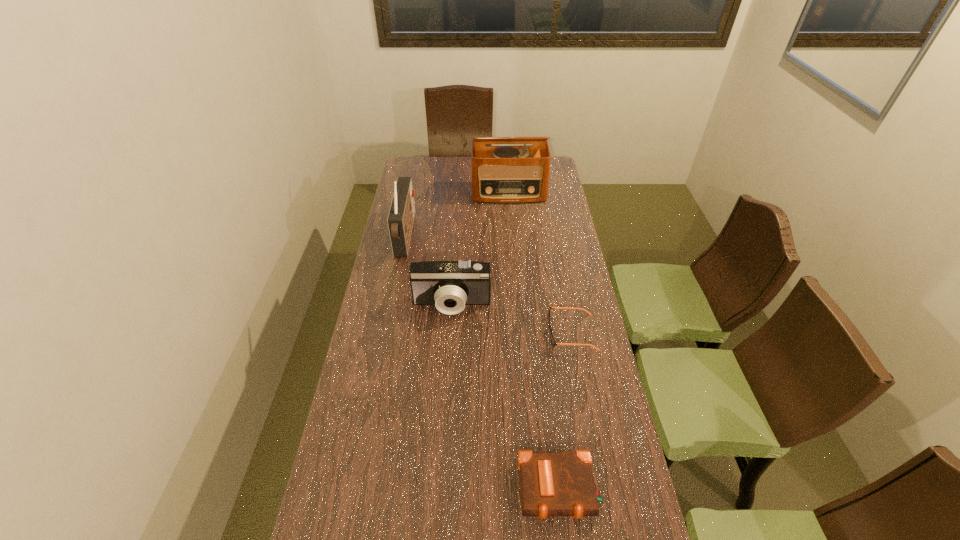
Image resolution: width=960 pixels, height=540 pixels. Identify the location of vacant space at the right edge. (588, 350).

Identify the location of free spot between the left radio receiver and the Bible. (483, 362).

Find the location of `blank region between the shortest object and the right radio receiver`. blank region between the shortest object and the right radio receiver is located at coordinates (540, 263).

Locate an element on the screen. The width and height of the screenshot is (960, 540). vacant area that lies between the third tallest object and the farther radio receiver is located at coordinates (481, 249).

At what (x,y) coordinates should I click in order to perform the action: click on free space between the left radio receiver and the right radio receiver. Please return your answer as a coordinate pair (x, y). Looking at the image, I should click on (457, 214).

The height and width of the screenshot is (540, 960). I want to click on free point between the camcorder and the farthest object, so click(481, 249).

You are a GUI agent. You are given a task and a screenshot of the screen. Output one action in this format:
    pyautogui.click(x=<x>, y=<y>)
    Task: Click on the vacant region between the nearest object and the third shortest object
    
    Given the screenshot: What is the action you would take?
    pyautogui.click(x=506, y=397)

Find the location of a particular element. free space between the farthest object and the camcorder is located at coordinates (481, 249).

Locate an element on the screen. The image size is (960, 540). empty space between the farthest object and the nearest object is located at coordinates (534, 341).

In order to click on free area in between the farther radio receiver and the camcorder in this screenshot , I will do `click(481, 249)`.